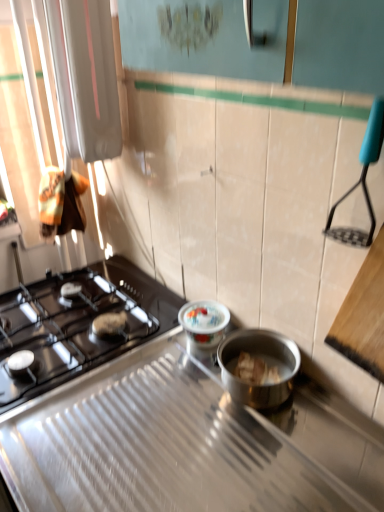
This screenshot has height=512, width=384. In order to click on vacant point above black matte gas stove at left, which is the second gas stove from back to front (from a real-world perspective) in this screenshot , I will do tap(150, 438).